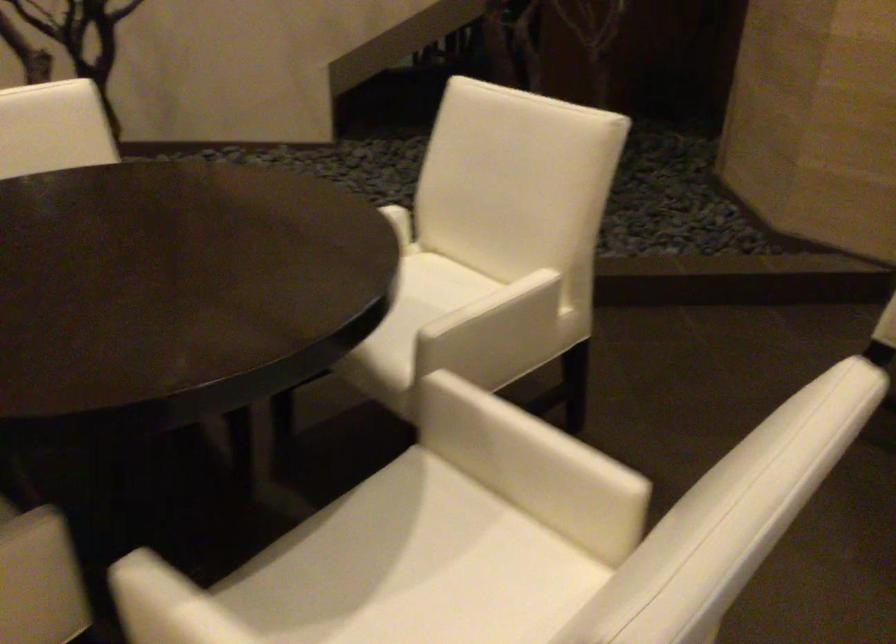
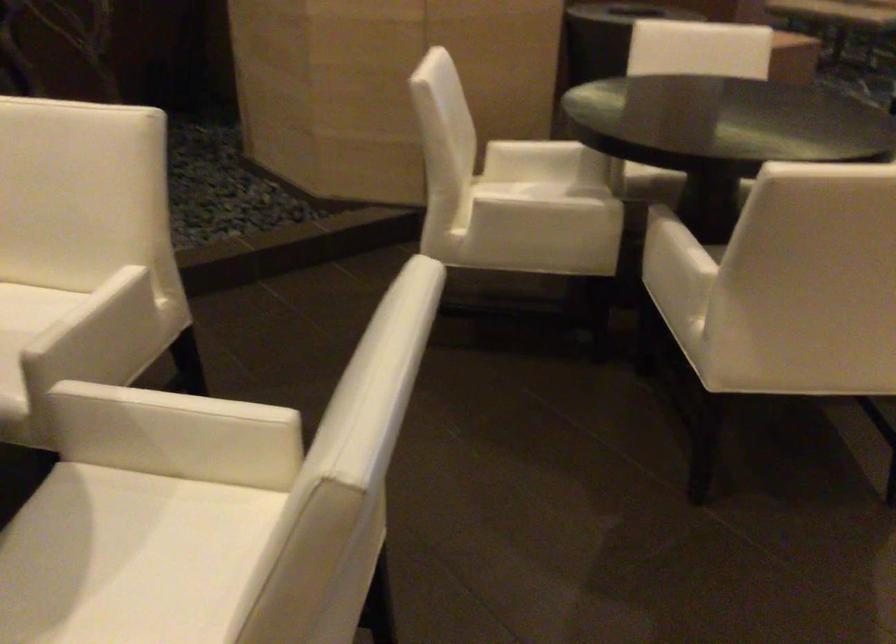
Question: Based on the continuous images, in which direction is the camera rotating? Reply with the corresponding letter.

Choices:
 (A) Left
 (B) Right
 (C) Up
 (D) Down

Answer: (B)